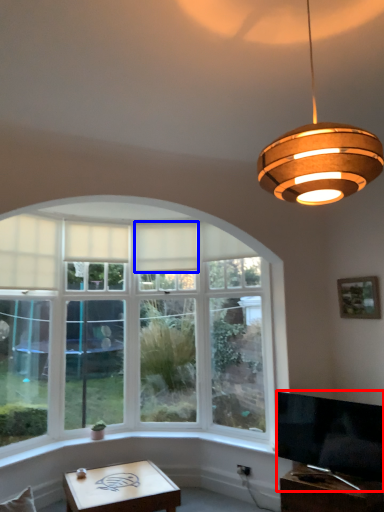
Question: Which object appears farthest to the camera in this image, television (highlighted by a red box) or curtain (highlighted by a blue box)?

Choices:
 (A) television
 (B) curtain

Answer: (B)